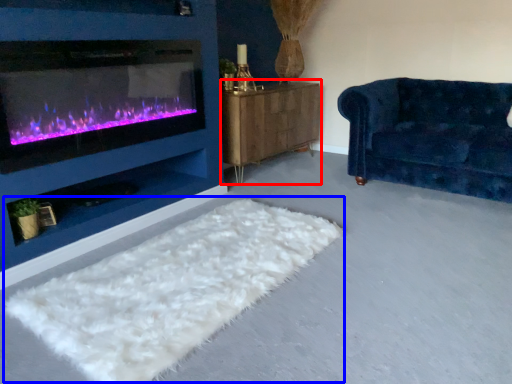
Question: Among these objects, which one is nearest to the camera, dresser (highlighted by a red box) or mat (highlighted by a blue box)?

Choices:
 (A) dresser
 (B) mat

Answer: (B)